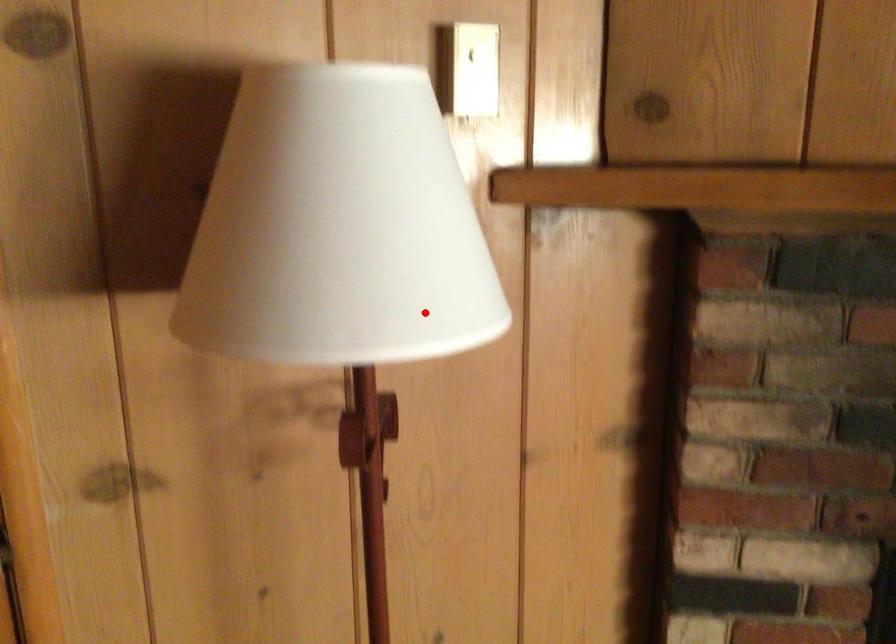
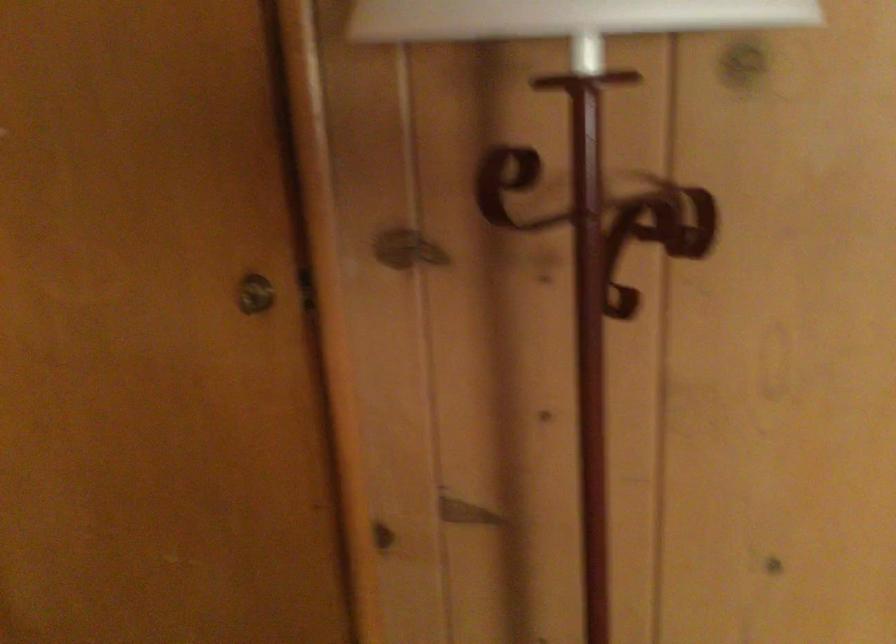
Locate, in the second image, the point that corresponds to the highlighted location in the first image.

(564, 17)